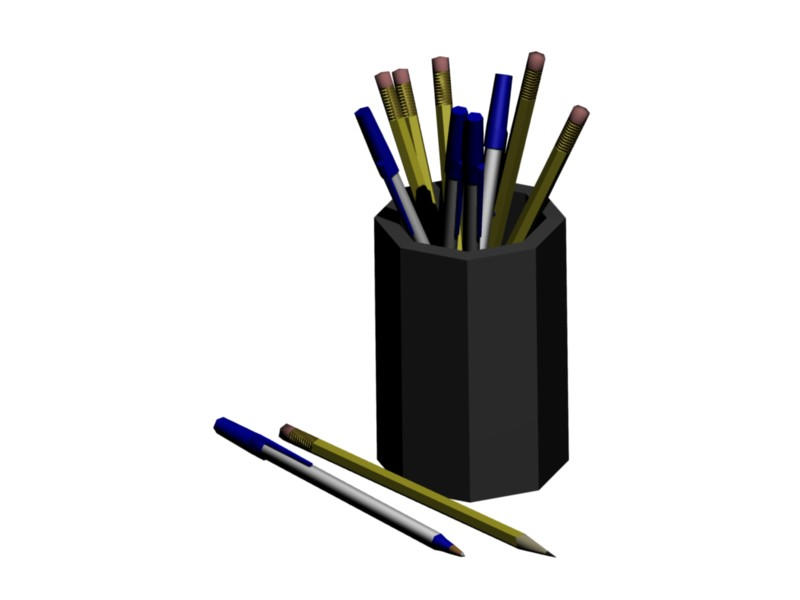
Find the location of a particular element. pens is located at coordinates (332, 484), (386, 160), (450, 139), (472, 139), (494, 117).